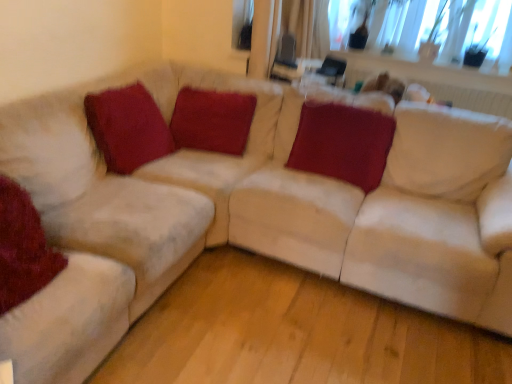
Question: Is velvet red pillow at lower left, which is counted as the first pillow, starting from the left, positioned beyond the bounds of satin red pillow at center, which appears as the 4th pillow when viewed from the left?

Choices:
 (A) no
 (B) yes

Answer: (B)

Question: Is velvet red pillow at lower left, which is counted as the first pillow, starting from the left, positioned with its back to satin red pillow at center, which is counted as the 1th pillow, starting from the right?

Choices:
 (A) yes
 (B) no

Answer: (B)

Question: From a real-world perspective, is velvet red pillow at lower left, which is counted as the first pillow, starting from the left, physically above satin red pillow at center, which is counted as the 1th pillow, starting from the right?

Choices:
 (A) yes
 (B) no

Answer: (B)

Question: From a real-world perspective, is velvet red pillow at lower left, acting as the 4th pillow starting from the right, physically below satin red pillow at center, which is counted as the 1th pillow, starting from the right?

Choices:
 (A) yes
 (B) no

Answer: (A)

Question: Is velvet red pillow at lower left, acting as the 4th pillow starting from the right, facing towards satin red pillow at center, which is counted as the 1th pillow, starting from the right?

Choices:
 (A) yes
 (B) no

Answer: (B)

Question: Would you say satin red pillow at center, which appears as the 4th pillow when viewed from the left, is inside or outside velvet red pillow at lower left, acting as the 4th pillow starting from the right?

Choices:
 (A) outside
 (B) inside

Answer: (A)

Question: Relative to velvet red pillow at lower left, which is counted as the first pillow, starting from the left, is satin red pillow at center, which is counted as the 1th pillow, starting from the right, in front or behind?

Choices:
 (A) front
 (B) behind

Answer: (B)

Question: Is satin red pillow at center, which appears as the 4th pillow when viewed from the left, wider or thinner than velvet red pillow at lower left, which is counted as the first pillow, starting from the left?

Choices:
 (A) thin
 (B) wide

Answer: (B)

Question: Is point (391, 117) positioned closer to the camera than point (4, 266)?

Choices:
 (A) farther
 (B) closer

Answer: (A)

Question: Is point (333, 173) positioned closer to the camera than point (108, 152)?

Choices:
 (A) farther
 (B) closer

Answer: (A)

Question: In terms of width, does satin red pillow at center, which appears as the 4th pillow when viewed from the left, look wider or thinner when compared to velvet red pillow at upper left, the third pillow viewed from the right?

Choices:
 (A) thin
 (B) wide

Answer: (B)

Question: From the image's perspective, is satin red pillow at center, which is counted as the 1th pillow, starting from the right, located above or below velvet red pillow at upper left, the 2th pillow positioned from the left?

Choices:
 (A) below
 (B) above

Answer: (A)

Question: From a real-world perspective, is satin red pillow at center, which appears as the 4th pillow when viewed from the left, positioned above or below velvet red pillow at upper left, the 2th pillow positioned from the left?

Choices:
 (A) above
 (B) below

Answer: (B)

Question: Is velvet red pillow at upper left, the 2th pillow positioned from the left, bigger or smaller than satin red pillow at center, which appears as the 4th pillow when viewed from the left?

Choices:
 (A) big
 (B) small

Answer: (B)

Question: Considering the positions of velvet red pillow at upper left, the 2th pillow positioned from the left, and satin red pillow at center, which appears as the 4th pillow when viewed from the left, in the image, is velvet red pillow at upper left, the 2th pillow positioned from the left, taller or shorter than satin red pillow at center, which appears as the 4th pillow when viewed from the left,?

Choices:
 (A) tall
 (B) short

Answer: (A)